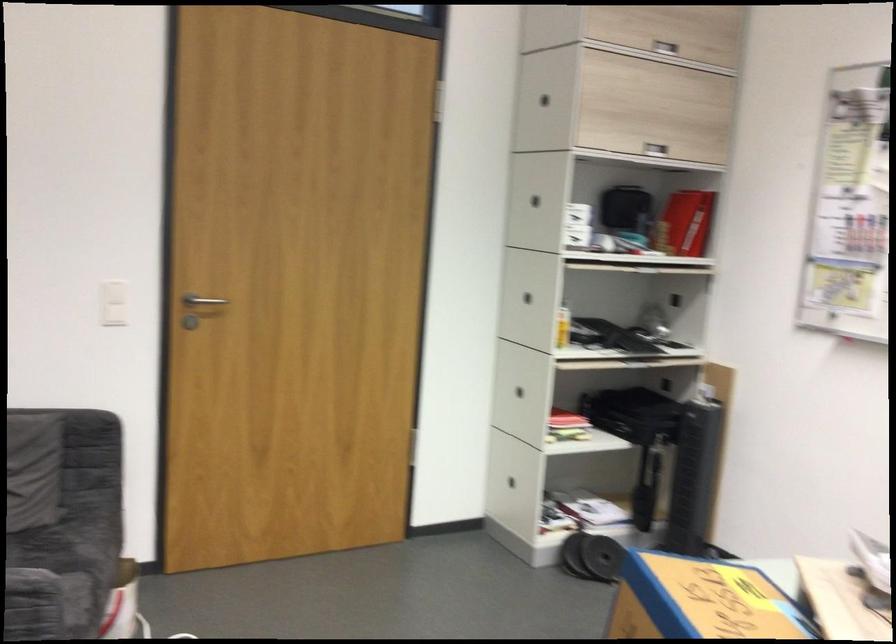
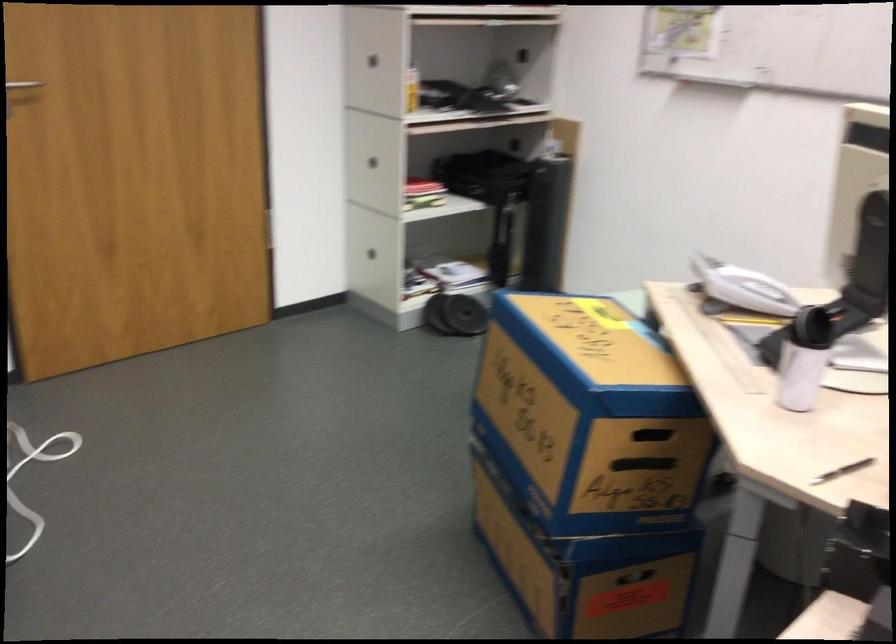
In a continuous first-person perspective shot, in which direction is the camera moving?

The cameraman walked toward left, backward.